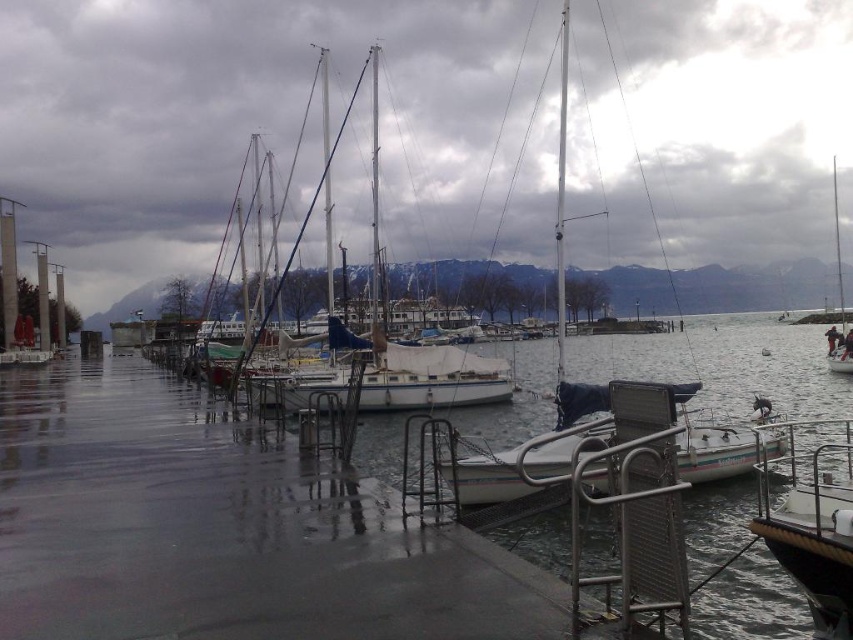
In the scene shown: You are standing on the dock and want to find the clear water at dock center. Where should you look relative to your position?

You should look towards the point at coordinates 0.825 on the x axis and 0.238 on the y axis relative to your position on the dock to find the clear water at dock center.

You are a maintenance worker at the marina. You need to place a new floating dock section that is 10 meters wide between the clear water at dock center and the white matte boat at center. Can the existing space accommodate this new dock section?

The clear water at dock center might be wider than the white matte boat at center, but since the exact width isn t specified, it s uncertain if the 10 meter dock section will fit. Check the actual measurements before proceeding.

You are standing on the dock and see a point marked at coordinates (250, 118). Which object is this point located on?

The point at coordinates (250, 118) is located on the white matte sailboat at center.